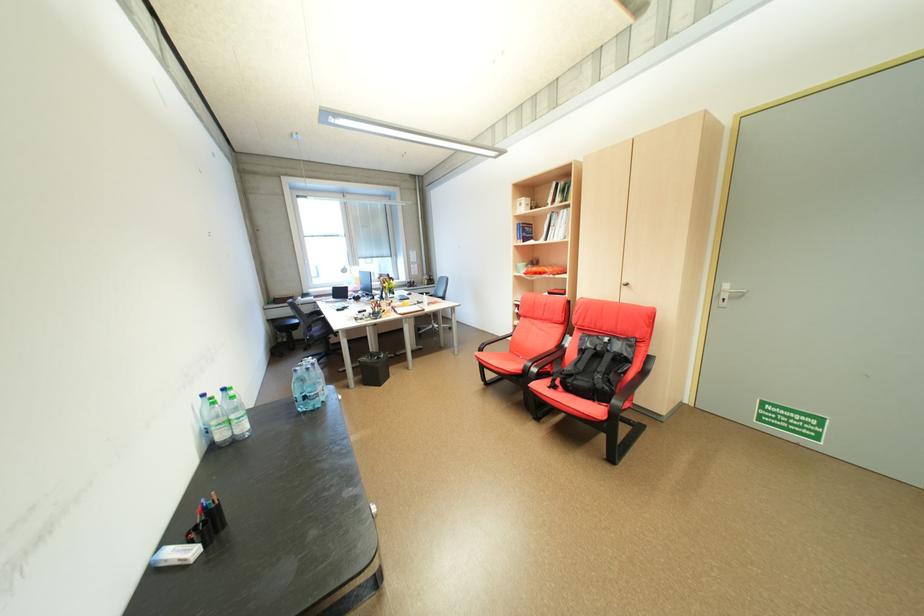
What do you see at coordinates (728, 294) in the screenshot?
I see `a white door handle` at bounding box center [728, 294].